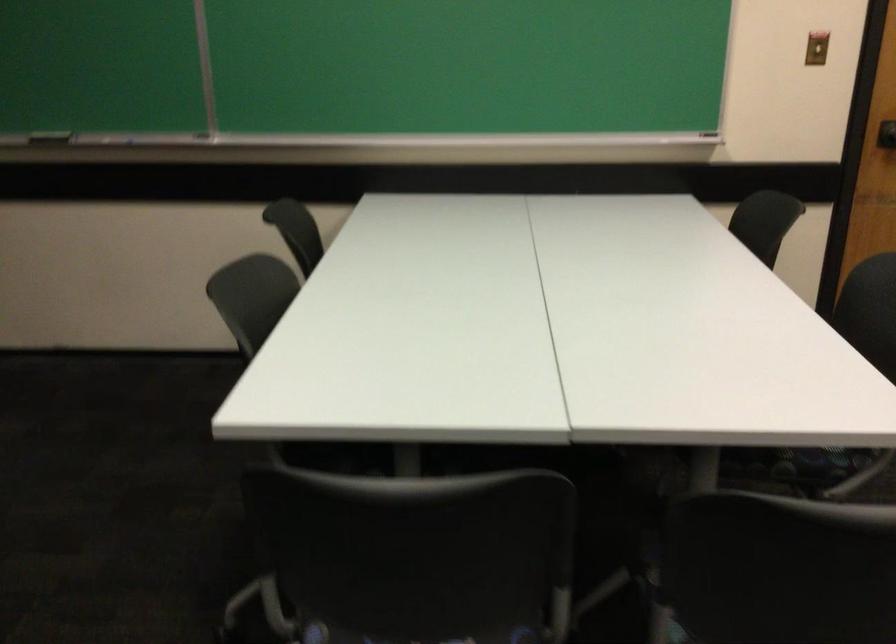
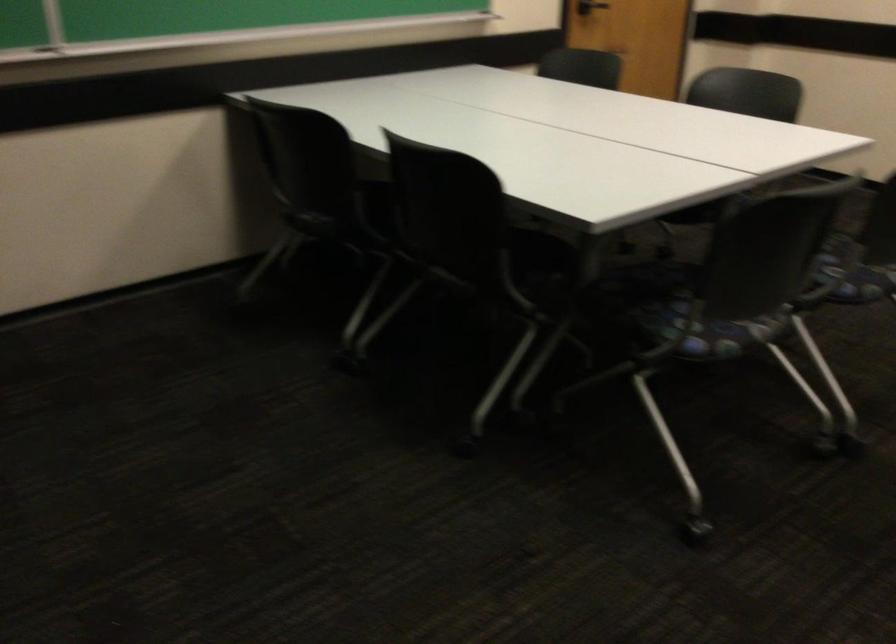
In the second image, find the point that corresponds to [694,456] in the first image.

(703, 214)